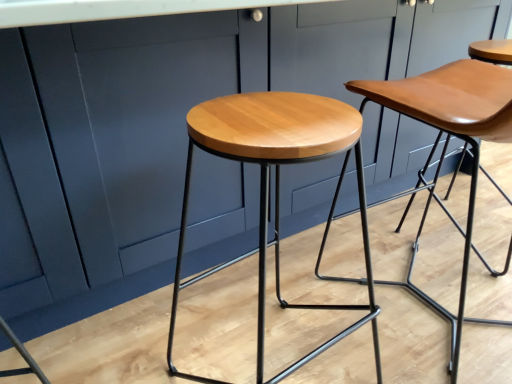
Image resolution: width=512 pixels, height=384 pixels. Find the location of `shiny wood stool at center, which is counted as the second stool, starting from the right`. shiny wood stool at center, which is counted as the second stool, starting from the right is located at coordinates (276, 184).

Image resolution: width=512 pixels, height=384 pixels. Describe the element at coordinates (276, 184) in the screenshot. I see `shiny wood stool at center, which is counted as the second stool, starting from the right` at that location.

This screenshot has width=512, height=384. What do you see at coordinates (447, 144) in the screenshot?
I see `matte wood stool at center, positioned as the 2th stool in left-to-right order` at bounding box center [447, 144].

Locate an element on the screen. matte wood stool at center, which ranks as the first stool in right-to-left order is located at coordinates (447, 144).

Identify the location of shiny wood stool at center, the 1th stool in the left-to-right sequence. (276, 184).

Which object is positioned more to the left, matte wood stool at center, positioned as the 2th stool in left-to-right order, or shiny wood stool at center, which is counted as the second stool, starting from the right?

From the viewer's perspective, shiny wood stool at center, which is counted as the second stool, starting from the right, appears more on the left side.

In the image, is matte wood stool at center, positioned as the 2th stool in left-to-right order, positioned in front of or behind shiny wood stool at center, the 1th stool in the left-to-right sequence?

Clearly, matte wood stool at center, positioned as the 2th stool in left-to-right order, is behind shiny wood stool at center, the 1th stool in the left-to-right sequence.

Considering the positions of points (422, 92) and (258, 133), is point (422, 92) closer to camera compared to point (258, 133)?

No, (422, 92) is further to viewer.

From the image's perspective, does matte wood stool at center, which ranks as the first stool in right-to-left order, appear higher than shiny wood stool at center, which is counted as the second stool, starting from the right?

Yes.

From a real-world perspective, between matte wood stool at center, positioned as the 2th stool in left-to-right order, and shiny wood stool at center, which is counted as the second stool, starting from the right, who is vertically lower?

shiny wood stool at center, which is counted as the second stool, starting from the right, from a real-world perspective.

Can you confirm if matte wood stool at center, which ranks as the first stool in right-to-left order, is thinner than shiny wood stool at center, which is counted as the second stool, starting from the right?

In fact, matte wood stool at center, which ranks as the first stool in right-to-left order, might be wider than shiny wood stool at center, which is counted as the second stool, starting from the right.

Does matte wood stool at center, positioned as the 2th stool in left-to-right order, have a greater height compared to shiny wood stool at center, the 1th stool in the left-to-right sequence?

Yes, matte wood stool at center, positioned as the 2th stool in left-to-right order, is taller than shiny wood stool at center, the 1th stool in the left-to-right sequence.

Who is smaller, matte wood stool at center, which ranks as the first stool in right-to-left order, or shiny wood stool at center, the 1th stool in the left-to-right sequence?

shiny wood stool at center, the 1th stool in the left-to-right sequence.

Is matte wood stool at center, which ranks as the first stool in right-to-left order, spatially inside shiny wood stool at center, which is counted as the second stool, starting from the right, or outside of it?

The correct answer is: outside.

Is matte wood stool at center, positioned as the 2th stool in left-to-right order, beside shiny wood stool at center, the 1th stool in the left-to-right sequence?

They are not placed beside each other.

Is matte wood stool at center, positioned as the 2th stool in left-to-right order, turned away from shiny wood stool at center, the 1th stool in the left-to-right sequence?

No.

How different are the orientations of matte wood stool at center, positioned as the 2th stool in left-to-right order, and shiny wood stool at center, the 1th stool in the left-to-right sequence, in degrees?

2.38 degrees.

You are a GUI agent. You are given a task and a screenshot of the screen. Output one action in this format:
    pyautogui.click(x=<x>, y=<y>)
    Task: Click on the stool below the matte wood stool at center, which ranks as the first stool in right-to-left order (from the image's perspective)
    This screenshot has height=384, width=512.
    Given the screenshot: What is the action you would take?
    pyautogui.click(x=276, y=184)

Considering the positions of objects shiny wood stool at center, which is counted as the second stool, starting from the right, and matte wood stool at center, which ranks as the first stool in right-to-left order, in the image provided, who is more to the left, shiny wood stool at center, which is counted as the second stool, starting from the right, or matte wood stool at center, which ranks as the first stool in right-to-left order,?

From the viewer's perspective, shiny wood stool at center, which is counted as the second stool, starting from the right, appears more on the left side.

Is the position of shiny wood stool at center, which is counted as the second stool, starting from the right, more distant than that of matte wood stool at center, which ranks as the first stool in right-to-left order?

No, it is in front of matte wood stool at center, which ranks as the first stool in right-to-left order.

Is point (221, 134) in front of point (475, 71)?

Yes, point (221, 134) is in front of point (475, 71).

From the image's perspective, relative to matte wood stool at center, which ranks as the first stool in right-to-left order, is shiny wood stool at center, which is counted as the second stool, starting from the right, above or below?

shiny wood stool at center, which is counted as the second stool, starting from the right, is situated lower than matte wood stool at center, which ranks as the first stool in right-to-left order, in the image.

From a real-world perspective, does shiny wood stool at center, the 1th stool in the left-to-right sequence, sit lower than matte wood stool at center, which ranks as the first stool in right-to-left order?

Yes, from a real-world perspective, shiny wood stool at center, the 1th stool in the left-to-right sequence, is under matte wood stool at center, which ranks as the first stool in right-to-left order.

Considering the sizes of shiny wood stool at center, the 1th stool in the left-to-right sequence, and matte wood stool at center, which ranks as the first stool in right-to-left order, in the image, is shiny wood stool at center, the 1th stool in the left-to-right sequence, wider or thinner than matte wood stool at center, which ranks as the first stool in right-to-left order,?

Considering their sizes, shiny wood stool at center, the 1th stool in the left-to-right sequence, looks slimmer than matte wood stool at center, which ranks as the first stool in right-to-left order.

Considering the sizes of objects shiny wood stool at center, which is counted as the second stool, starting from the right, and matte wood stool at center, positioned as the 2th stool in left-to-right order, in the image provided, who is shorter, shiny wood stool at center, which is counted as the second stool, starting from the right, or matte wood stool at center, positioned as the 2th stool in left-to-right order,?

With less height is shiny wood stool at center, which is counted as the second stool, starting from the right.

Does shiny wood stool at center, which is counted as the second stool, starting from the right, have a smaller size compared to matte wood stool at center, positioned as the 2th stool in left-to-right order?

Indeed, shiny wood stool at center, which is counted as the second stool, starting from the right, has a smaller size compared to matte wood stool at center, positioned as the 2th stool in left-to-right order.

Choose the correct answer: Is shiny wood stool at center, which is counted as the second stool, starting from the right, inside matte wood stool at center, which ranks as the first stool in right-to-left order, or outside it?

shiny wood stool at center, which is counted as the second stool, starting from the right, is not inside matte wood stool at center, which ranks as the first stool in right-to-left order, it's outside.

Is there a large distance between shiny wood stool at center, which is counted as the second stool, starting from the right, and matte wood stool at center, which ranks as the first stool in right-to-left order?

No, shiny wood stool at center, which is counted as the second stool, starting from the right, is not far away from matte wood stool at center, which ranks as the first stool in right-to-left order.

Is shiny wood stool at center, which is counted as the second stool, starting from the right, facing towards matte wood stool at center, which ranks as the first stool in right-to-left order?

No, shiny wood stool at center, which is counted as the second stool, starting from the right, is not turned towards matte wood stool at center, which ranks as the first stool in right-to-left order.

Find the location of `stool behind the shiny wood stool at center, the 1th stool in the left-to-right sequence`. stool behind the shiny wood stool at center, the 1th stool in the left-to-right sequence is located at coordinates (447, 144).

The width and height of the screenshot is (512, 384). I want to click on stool above the shiny wood stool at center, which is counted as the second stool, starting from the right (from a real-world perspective), so coord(447,144).

You are a GUI agent. You are given a task and a screenshot of the screen. Output one action in this format:
    pyautogui.click(x=<x>, y=<y>)
    Task: Click on the stool on the right of shiny wood stool at center, the 1th stool in the left-to-right sequence
    Image resolution: width=512 pixels, height=384 pixels.
    Given the screenshot: What is the action you would take?
    pos(447,144)